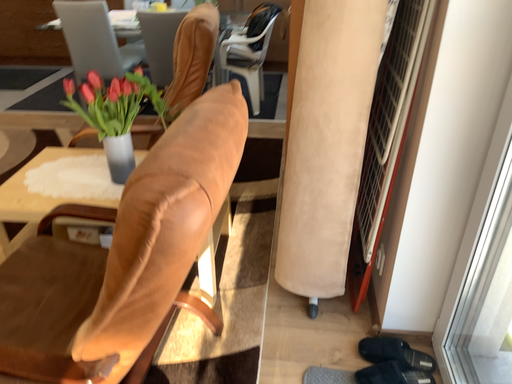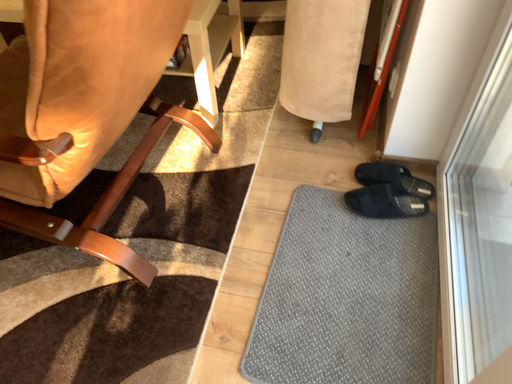
Question: Which way did the camera rotate in the video?

Choices:
 (A) rotated right
 (B) rotated left

Answer: (B)